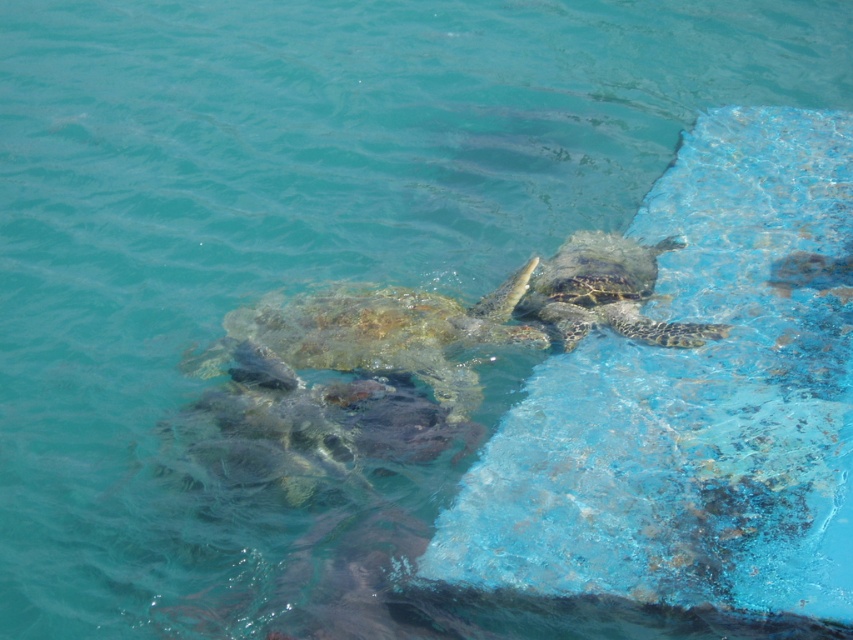
Does point (241, 308) come behind point (558, 326)?

Yes, it is.

The width and height of the screenshot is (853, 640). What do you see at coordinates (381, 333) in the screenshot?
I see `rusty brown shell at center` at bounding box center [381, 333].

Between point (439, 298) and point (630, 284), which one is positioned behind?

The point (630, 284) is behind.

The height and width of the screenshot is (640, 853). I want to click on rusty brown shell at center, so click(x=381, y=333).